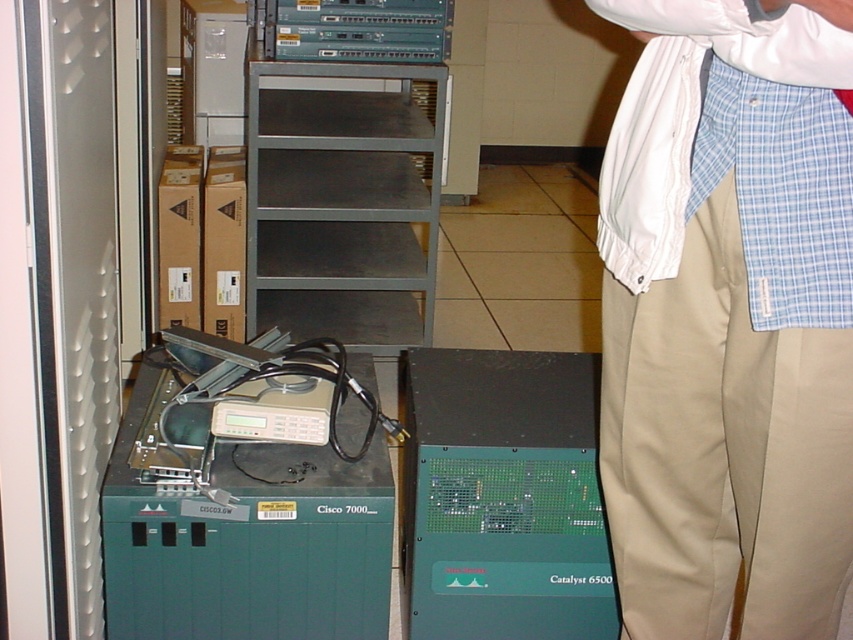
You are a technician in the server room and need to reach the khaki cotton pants at lower right. Considering your current position, can you comfortably reach it without moving your feet?

The khaki cotton pants at lower right is 31.55 inches away from the viewer. Since this distance is within typical comfortable reaching range, you can likely reach it without moving your feet.

You are a technician working in a server room. You need to access the khaki cotton pants at lower right located at point (728, 317). The Cisco 7000 and Catalyst 6500 are in the way. Which device should you move first to reach the khaki cotton pants at lower right?

You should move the Catalyst 6500 first because the khaki cotton pants at lower right is located at point (728, 317), which is closer to the Catalyst 6500 than the Cisco 7000.